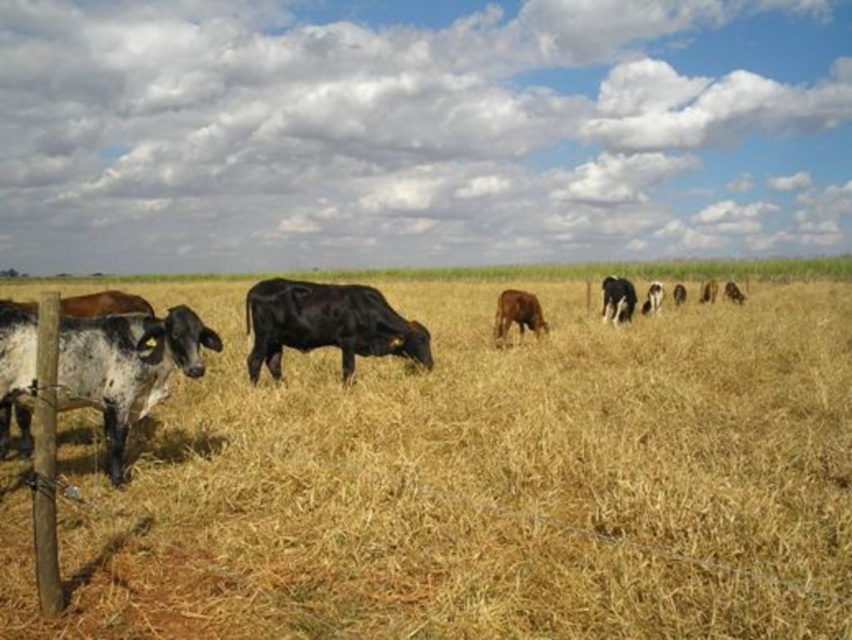
Is black smooth cow at center taller than brown matte cow at center?

Yes.

Which of these two, black smooth cow at center or brown matte cow at center, stands taller?

black smooth cow at center is taller.

Measure the distance between black smooth cow at center and camera.

The distance of black smooth cow at center from camera is 10.08 meters.

Image resolution: width=852 pixels, height=640 pixels. Find the location of `black smooth cow at center`. black smooth cow at center is located at coordinates (326, 324).

This screenshot has width=852, height=640. Describe the element at coordinates (476, 483) in the screenshot. I see `dry straw at center` at that location.

Who is lower down, dry straw at center or speckled white/black fur at left?

Positioned lower is dry straw at center.

Is point (173, 394) positioned behind point (65, 324)?

Yes, it is behind point (65, 324).

At what (x,y) coordinates should I click in order to perform the action: click on dry straw at center. Please return your answer as a coordinate pair (x, y). The width and height of the screenshot is (852, 640). Looking at the image, I should click on (476, 483).

Can you confirm if speckled white/black fur at left is taller than brown matte cow at center?

Indeed, speckled white/black fur at left has a greater height compared to brown matte cow at center.

Can you confirm if speckled white/black fur at left is positioned to the right of brown matte cow at center?

Incorrect, speckled white/black fur at left is not on the right side of brown matte cow at center.

The image size is (852, 640). Describe the element at coordinates (127, 365) in the screenshot. I see `speckled white/black fur at left` at that location.

The height and width of the screenshot is (640, 852). I want to click on speckled white/black fur at left, so click(x=127, y=365).